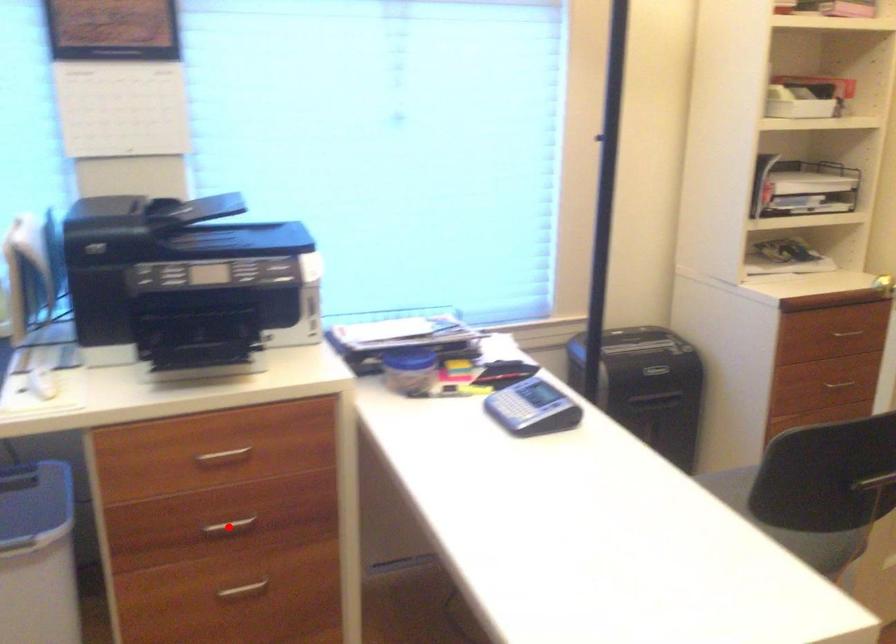
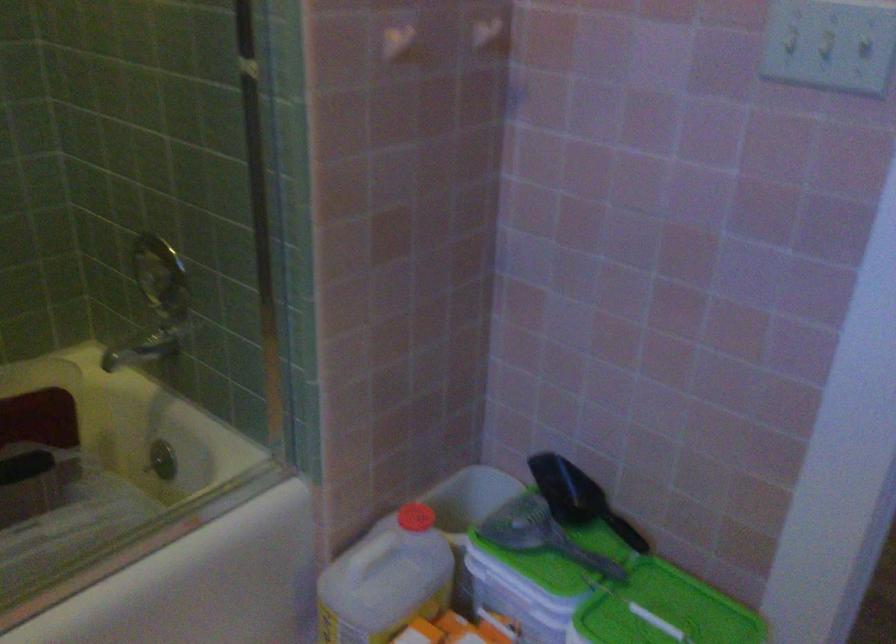
Question: I am providing you with two images of the same scene from different viewpoints. A red point is marked on the first image. Can you still see the location of the red point in image 2?

Choices:
 (A) Yes
 (B) No

Answer: (B)